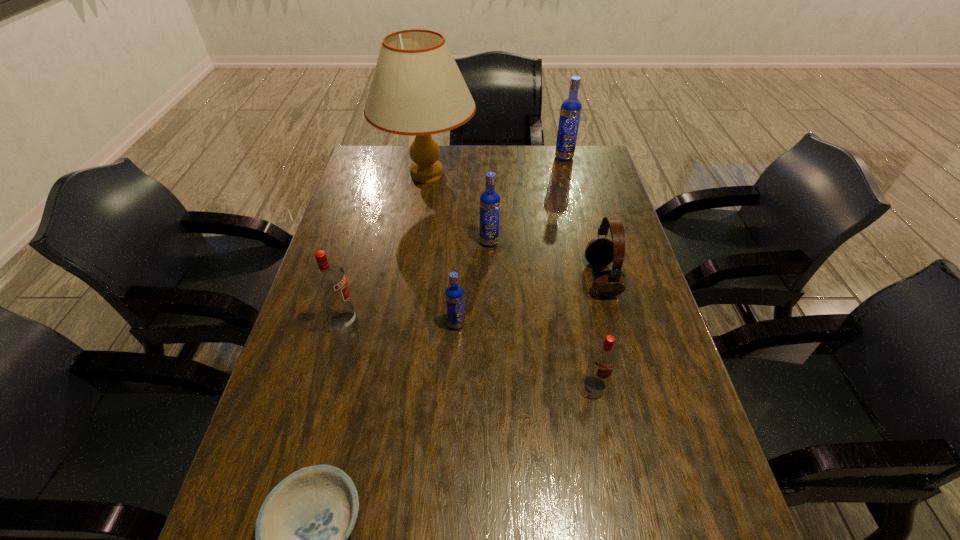
The image size is (960, 540). Find the location of `free space located 0.190m on the ear pads of the black headset`. free space located 0.190m on the ear pads of the black headset is located at coordinates (518, 278).

Where is `free region located on the front of the second vodka from left to right`? This screenshot has height=540, width=960. free region located on the front of the second vodka from left to right is located at coordinates (452, 421).

The image size is (960, 540). I want to click on vacant space situated 0.160m on the front label of the nearer red vodka, so pyautogui.click(x=612, y=471).

The width and height of the screenshot is (960, 540). I want to click on lampshade located in the far edge section of the desktop, so click(417, 89).

Find the location of a particular element. vodka that is at the far edge is located at coordinates (571, 108).

Locate an element on the screen. lampshade situated at the left edge is located at coordinates click(x=417, y=89).

This screenshot has width=960, height=540. Identify the location of vodka that is at the left edge. (329, 281).

The image size is (960, 540). What are the coordinates of `vodka present at the right edge` in the screenshot? It's located at (571, 108).

Locate an element on the screen. headset that is at the right edge is located at coordinates (600, 251).

You are a GUI agent. You are given a task and a screenshot of the screen. Output one action in this format:
    pyautogui.click(x=<x>, y=<y>)
    Task: Click on the object present at the far left corner
    
    Given the screenshot: What is the action you would take?
    pyautogui.click(x=417, y=89)